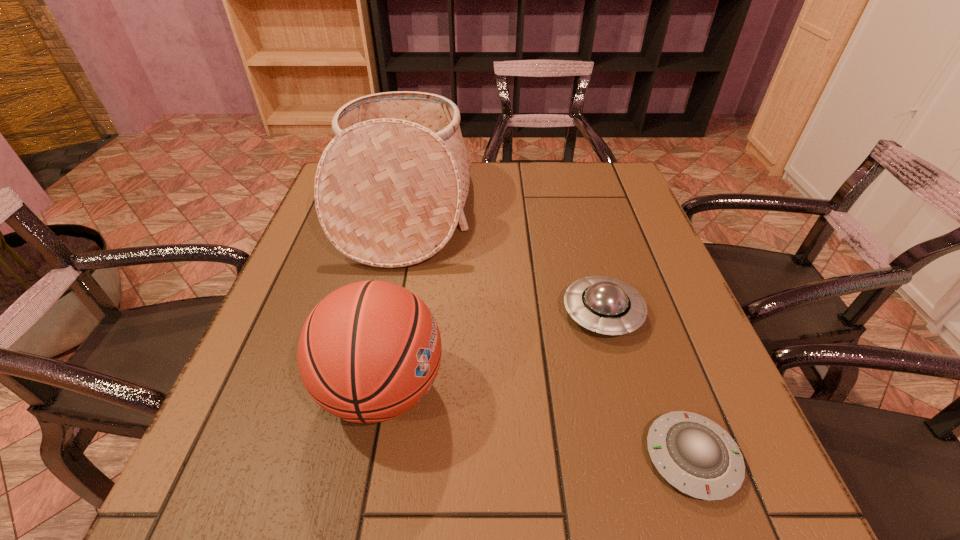
Identify the location of vacant space at the far right corner of the desktop. (620, 169).

Locate an element on the screen. This screenshot has height=540, width=960. vacant area between the farthest object and the nearer saucer is located at coordinates (547, 333).

Locate an element on the screen. This screenshot has width=960, height=540. empty space between the farther saucer and the basketball is located at coordinates (492, 351).

The height and width of the screenshot is (540, 960). Identify the location of free spot between the tallest object and the shorter saucer. (547, 333).

The width and height of the screenshot is (960, 540). In order to click on free space between the basketball and the taller saucer in this screenshot , I will do `click(492, 351)`.

Where is `free spot between the farthest object and the shorter saucer`? The width and height of the screenshot is (960, 540). free spot between the farthest object and the shorter saucer is located at coordinates (547, 333).

The width and height of the screenshot is (960, 540). I want to click on unoccupied area between the shortest object and the second tallest object, so click(537, 423).

Where is `vacant space that is in between the shorter saucer and the basketball`? vacant space that is in between the shorter saucer and the basketball is located at coordinates (537, 423).

This screenshot has height=540, width=960. Identify the location of empty location between the shorter saucer and the basketball. (537, 423).

Identify which object is the third nearest to the nearer saucer. Please provide its 2D coordinates. Your answer should be formatted as a tuple, i.e. [(x, y)], where the tuple contains the x and y coordinates of a point satisfying the conditions above.

[(390, 188)]